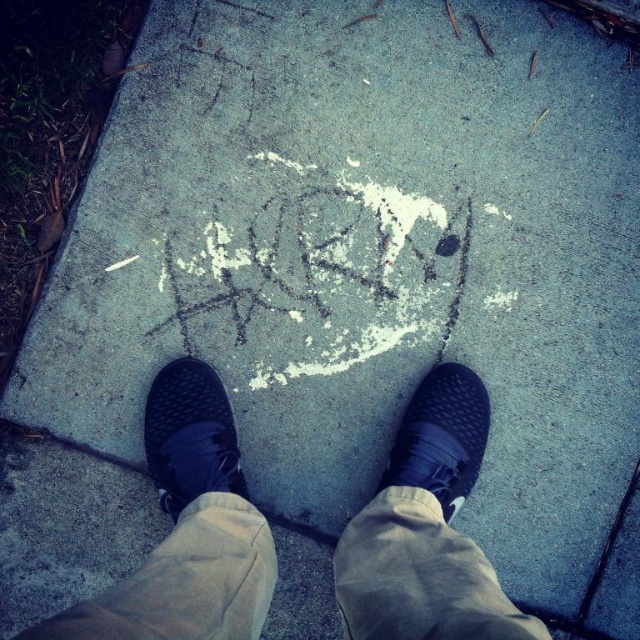
Question: Which point is closer to the camera?

Choices:
 (A) (228, 227)
 (B) (179, 541)

Answer: (B)

Question: Is white chalk writing at center to the right of black rubber crack at lower right from the viewer's perspective?

Choices:
 (A) no
 (B) yes

Answer: (A)

Question: Is black mesh sneakers at center to the right of black mesh shoe at lower left from the viewer's perspective?

Choices:
 (A) no
 (B) yes

Answer: (B)

Question: Is black mesh sneakers at center in front of black mesh shoe at lower left?

Choices:
 (A) no
 (B) yes

Answer: (B)

Question: Which of the following is the closest to the observer?

Choices:
 (A) (445, 332)
 (B) (598, 614)

Answer: (B)

Question: Which of these objects is positioned closest to the black mesh shoe at lower left?

Choices:
 (A) black rubber crack at lower right
 (B) white chalk writing at center

Answer: (B)